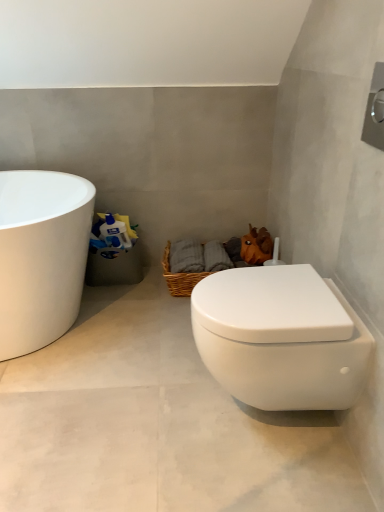
Where is `vacant space situated above white matte toilet at lower right (from a real-world perspective)`? This screenshot has height=512, width=384. vacant space situated above white matte toilet at lower right (from a real-world perspective) is located at coordinates (132, 365).